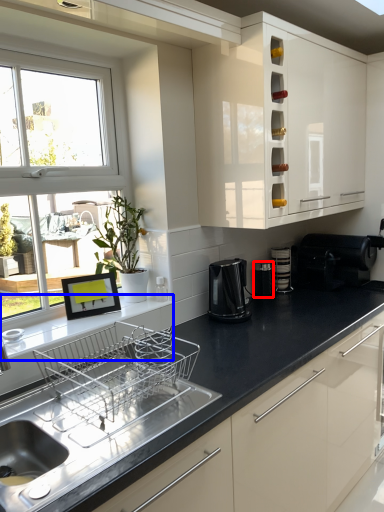
Question: Which object is closer to the camera taking this photo, appliance (highlighted by a red box) or window sill (highlighted by a blue box)?

Choices:
 (A) appliance
 (B) window sill

Answer: (B)